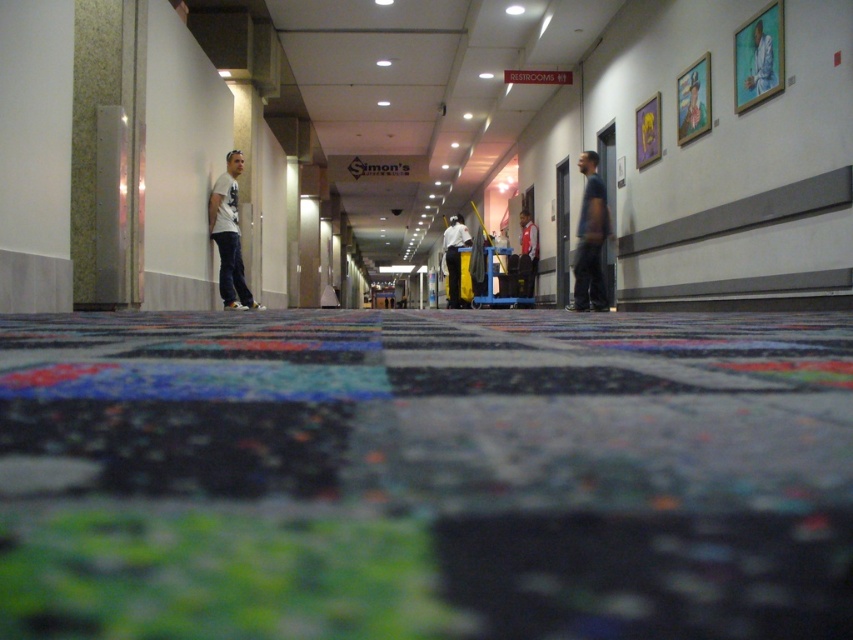
Question: Can you confirm if white glossy shirt at center is wider than red shirt at center?

Choices:
 (A) yes
 (B) no

Answer: (A)

Question: Which object is positioned farthest from the red shirt at center?

Choices:
 (A) white glossy shirt at center
 (B) blue fabric shirt at upper right

Answer: (B)

Question: Which point appears closest to the camera in this image?

Choices:
 (A) (224, 268)
 (B) (577, 230)
 (C) (750, 67)

Answer: (C)

Question: Observing the image, what is the correct spatial positioning of dark blue shirt at right in reference to red shirt at center?

Choices:
 (A) left
 (B) right

Answer: (B)

Question: Which object appears farthest from the camera in this image?

Choices:
 (A) red shirt at center
 (B) white matte t-shirt at left

Answer: (A)

Question: Is blue fabric shirt at upper right positioned behind red shirt at center?

Choices:
 (A) yes
 (B) no

Answer: (B)